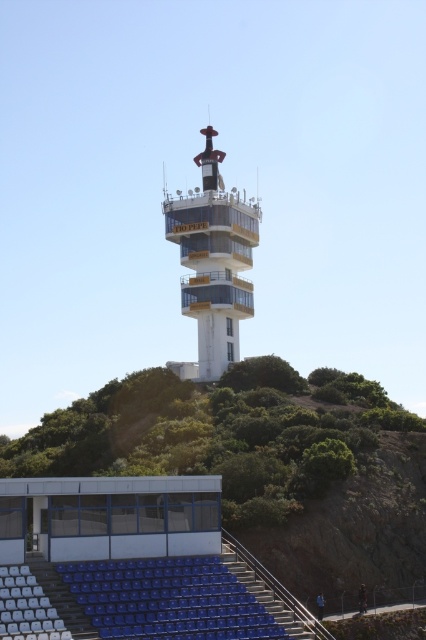
You are planning to build a new pathway between the green leafy hillside at upper center and the white glossy tower at center. Since the hillside is wider than the tower, which side should you place the pathway closer to for better stability?

The pathway should be placed closer to the green leafy hillside at upper center because it is wider than the white glossy tower at center, providing a more stable foundation.

You are a maintenance worker needing to reach the white glass amphitheater at lower left from the blue plastic seats at lower left with a 1.5 meter long tool. Can you safely extend the tool to reach it without overextending?

The distance between the blue plastic seats at lower left and the white glass amphitheater at lower left is 1.60 meters. Since the tool is only 1.5 meters long, you cannot safely reach the amphitheater without overextending the tool.

You are standing at the base of the observation tower and want to reach the viewing platform. Which object, the green leafy hillside at upper center or the blue plastic seats at lower left, is closer to your current position?

The blue plastic seats at lower left are closer to your current position because they are located below the green leafy hillside at upper center.